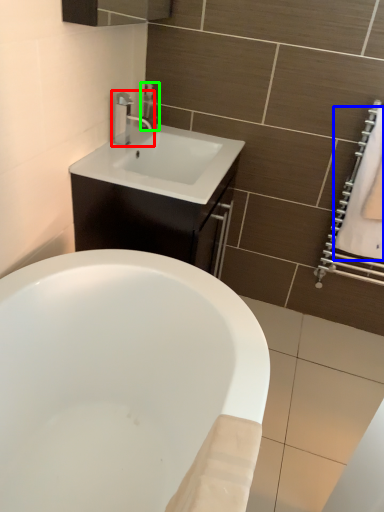
Question: Based on their relative distances, which object is farther from tap (highlighted by a red box)? Choose from bath towel (highlighted by a blue box) and soap dispenser (highlighted by a green box).

Choices:
 (A) bath towel
 (B) soap dispenser

Answer: (A)